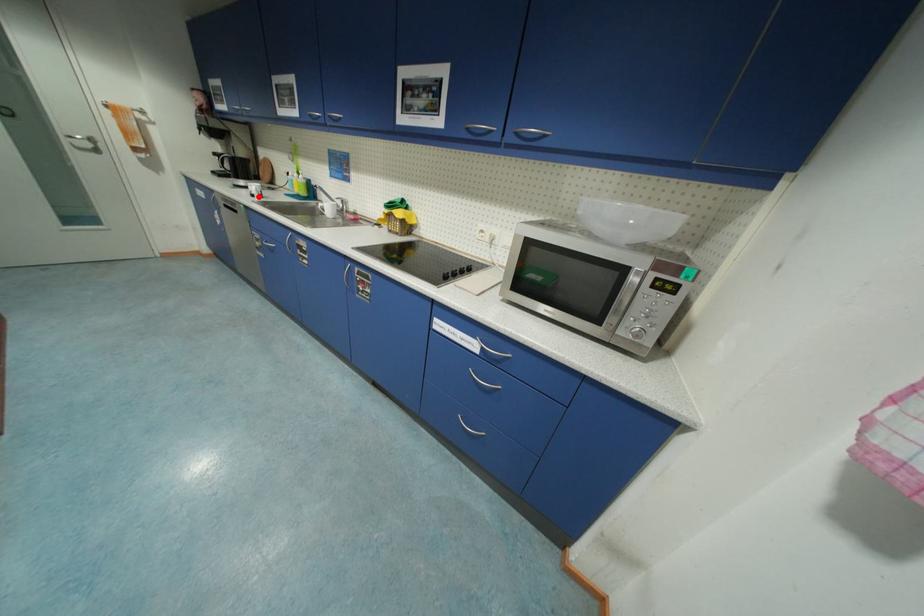
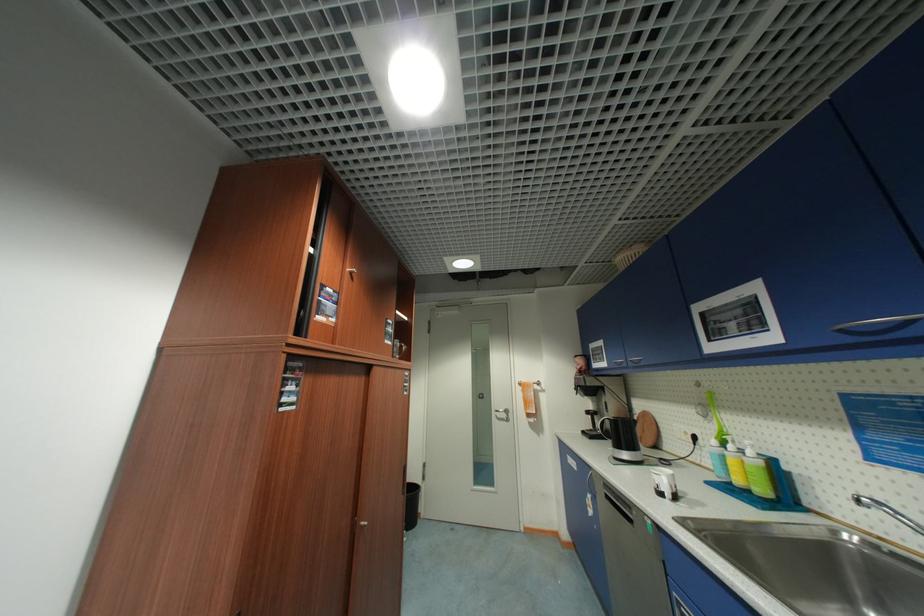
The point at the highlighted location is marked in the first image. Where is the corresponding point in the second image?

(666, 495)